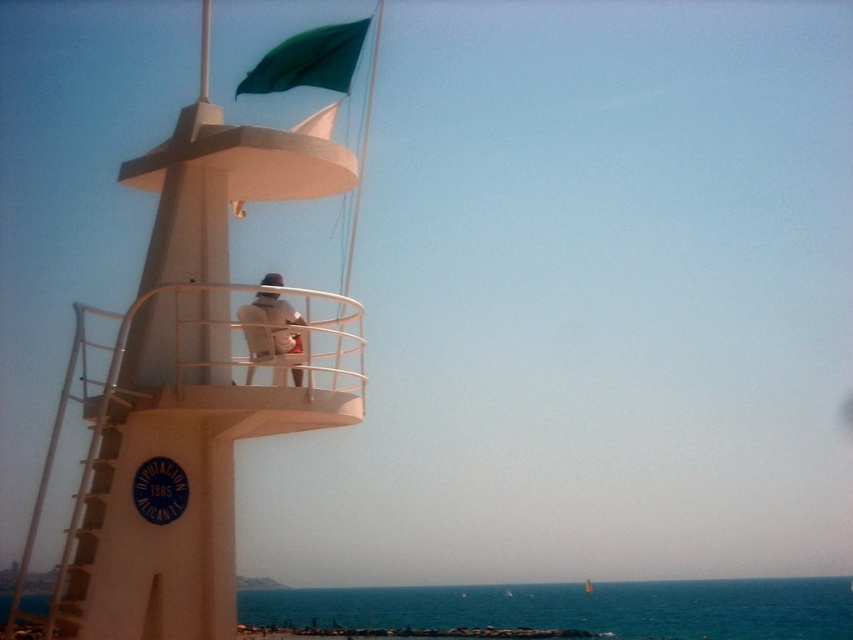
Question: Is white glossy mast at upper center to the right of yellow fabric sailboat at center from the viewer's perspective?

Choices:
 (A) no
 (B) yes

Answer: (A)

Question: Can you confirm if green fabric flag at upper center is positioned to the left of yellow fabric sailboat at center?

Choices:
 (A) no
 (B) yes

Answer: (B)

Question: Which is nearer to the yellow fabric sailboat at center?

Choices:
 (A) white glossy mast at upper center
 (B) white matte tower at center

Answer: (A)

Question: Does blue water at lower center appear on the right side of light brown leather jacket at center?

Choices:
 (A) no
 (B) yes

Answer: (B)

Question: Which object appears closest to the camera in this image?

Choices:
 (A) blue water at lower center
 (B) light brown leather jacket at center
 (C) white glossy mast at upper center

Answer: (A)

Question: Which object appears farthest from the camera in this image?

Choices:
 (A) green fabric flag at upper center
 (B) light brown leather jacket at center
 (C) white matte tower at center

Answer: (A)